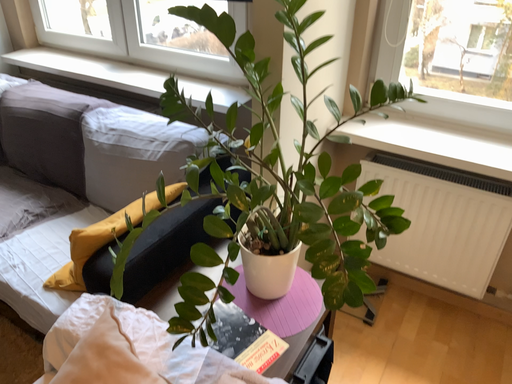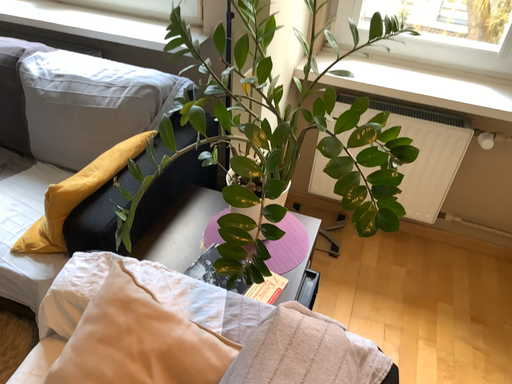
Question: How did the camera likely rotate when shooting the video?

Choices:
 (A) rotated right
 (B) rotated left

Answer: (A)